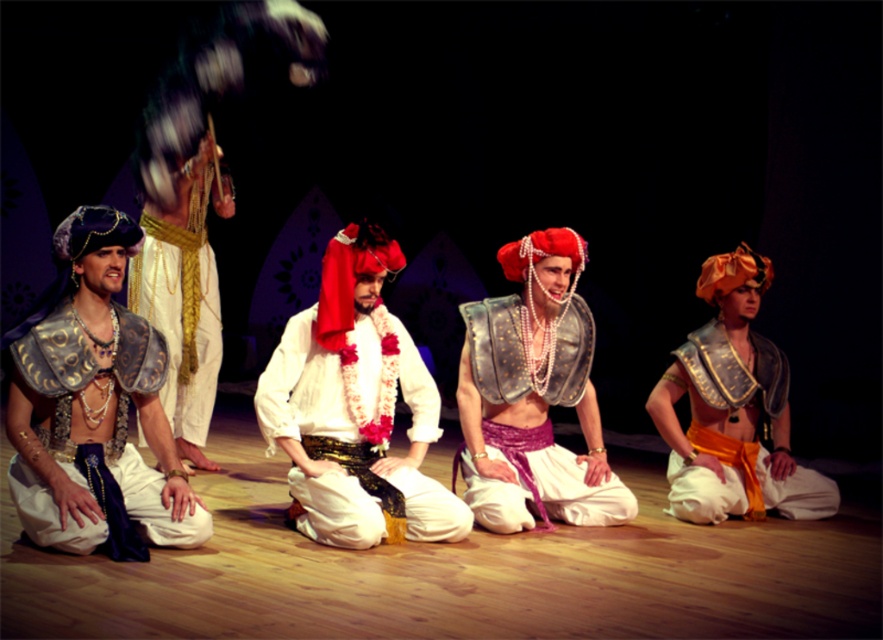
Can you confirm if metallic armor at center is positioned to the right of matte gold armor at center?

No, metallic armor at center is not to the right of matte gold armor at center.

What are the coordinates of `metallic armor at center` in the screenshot? It's located at (533, 396).

Can you confirm if white satin shirt at center is positioned above metallic blue fabric at left?

Yes.

Is white satin shirt at center shorter than metallic blue fabric at left?

In fact, white satin shirt at center may be taller than metallic blue fabric at left.

Describe the element at coordinates (355, 408) in the screenshot. The image size is (883, 640). I see `white satin shirt at center` at that location.

I want to click on white satin shirt at center, so click(355, 408).

Based on the photo, is white satin shirt at center smaller than metallic armor at center?

No, white satin shirt at center is not smaller than metallic armor at center.

Describe the element at coordinates (355, 408) in the screenshot. I see `white satin shirt at center` at that location.

Is point (413, 390) closer to viewer compared to point (542, 316)?

Yes, it is.

I want to click on white satin shirt at center, so click(355, 408).